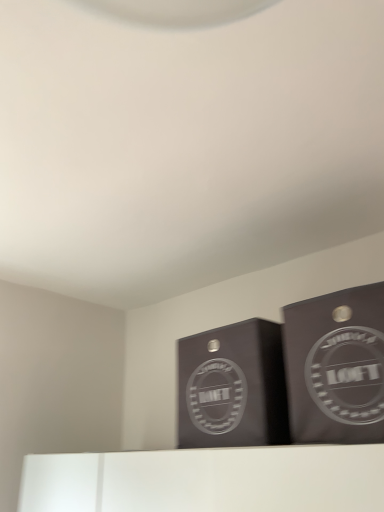
Question: Considering the relative positions of matte black cardboard box at upper right, which is the 1th cardboard box in right-to-left order, and matte black box at center, which appears as the second cardboard box when viewed from the right, in the image provided, is matte black cardboard box at upper right, which is the 1th cardboard box in right-to-left order, behind matte black box at center, which appears as the second cardboard box when viewed from the right,?

Choices:
 (A) no
 (B) yes

Answer: (A)

Question: Can you confirm if matte black cardboard box at upper right, which is the 1th cardboard box in right-to-left order, is positioned to the right of matte black box at center, which appears as the second cardboard box when viewed from the right?

Choices:
 (A) yes
 (B) no

Answer: (A)

Question: Is matte black box at center, the 1th cardboard box positioned from the left, a part of matte black cardboard box at upper right, which is the 1th cardboard box in right-to-left order?

Choices:
 (A) no
 (B) yes

Answer: (A)

Question: Could you tell me if matte black cardboard box at upper right, which is the 1th cardboard box in right-to-left order, is turned towards matte black box at center, the 1th cardboard box positioned from the left?

Choices:
 (A) no
 (B) yes

Answer: (A)

Question: Can you confirm if matte black cardboard box at upper right, which is the 1th cardboard box in right-to-left order, is shorter than matte black box at center, which appears as the second cardboard box when viewed from the right?

Choices:
 (A) no
 (B) yes

Answer: (A)

Question: Can you confirm if matte black cardboard box at upper right, which is the 1th cardboard box in right-to-left order, is taller than matte black box at center, which appears as the second cardboard box when viewed from the right?

Choices:
 (A) no
 (B) yes

Answer: (B)

Question: From the image's perspective, is matte black box at center, the 1th cardboard box positioned from the left, on matte black cardboard box at upper right, which is the 1th cardboard box in right-to-left order?

Choices:
 (A) no
 (B) yes

Answer: (A)

Question: Is matte black box at center, the 1th cardboard box positioned from the left, aimed at matte black cardboard box at upper right, which is the 1th cardboard box in right-to-left order?

Choices:
 (A) yes
 (B) no

Answer: (B)

Question: From the image's perspective, is matte black box at center, which appears as the second cardboard box when viewed from the right, under matte black cardboard box at upper right, the 2th cardboard box viewed from the left?

Choices:
 (A) yes
 (B) no

Answer: (A)

Question: Is matte black box at center, which appears as the second cardboard box when viewed from the right, oriented away from matte black cardboard box at upper right, which is the 1th cardboard box in right-to-left order?

Choices:
 (A) no
 (B) yes

Answer: (A)

Question: Is matte black box at center, which appears as the second cardboard box when viewed from the right, wider than matte black cardboard box at upper right, which is the 1th cardboard box in right-to-left order?

Choices:
 (A) no
 (B) yes

Answer: (B)

Question: From a real-world perspective, does matte black box at center, which appears as the second cardboard box when viewed from the right, stand above matte black cardboard box at upper right, which is the 1th cardboard box in right-to-left order?

Choices:
 (A) yes
 (B) no

Answer: (A)

Question: From the image's perspective, relative to matte black cardboard box at upper right, the 2th cardboard box viewed from the left, is matte black box at center, which appears as the second cardboard box when viewed from the right, above or below?

Choices:
 (A) above
 (B) below

Answer: (B)